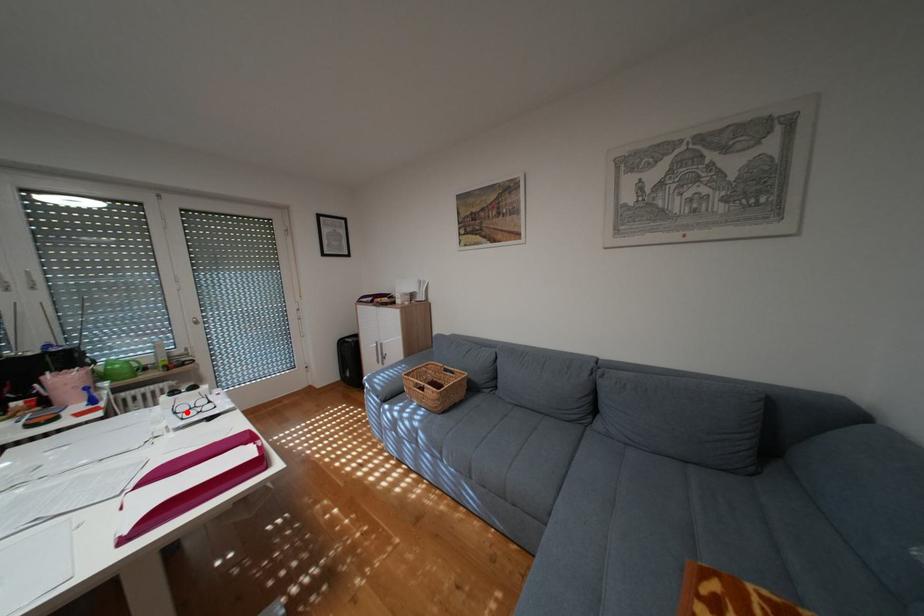
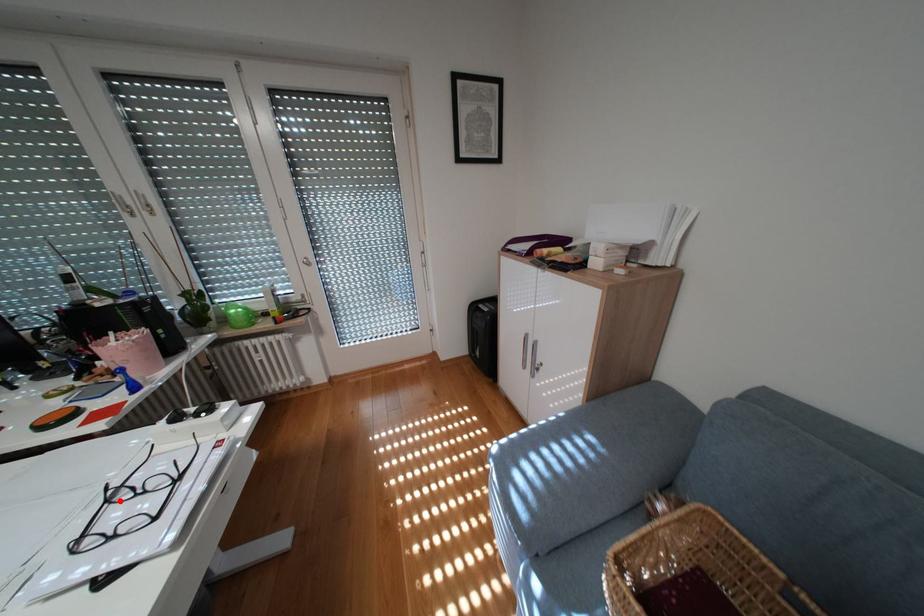
I am providing you with two images of the same scene from different viewpoints. A red point is marked on the first image and another point is marked on the second image. Do the highlighted points in image1 and image2 indicate the same real-world spot?

Yes